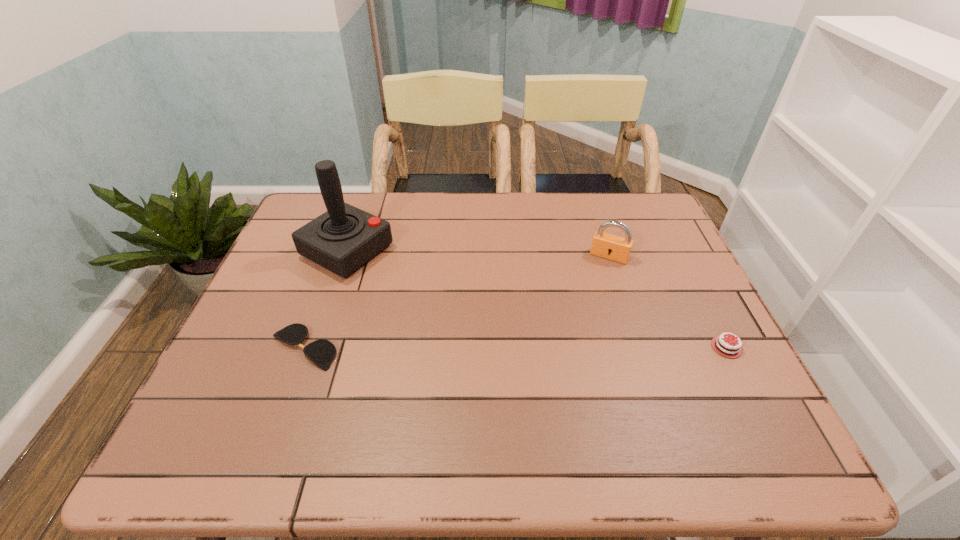
The width and height of the screenshot is (960, 540). Identify the location of vacant space situated 0.170m on the base of the joystick. (429, 292).

What are the coordinates of `vacant space situated 0.300m to unlock the third shortest object from the front` in the screenshot? It's located at (570, 340).

Image resolution: width=960 pixels, height=540 pixels. I want to click on free point located 0.180m to unlock the third shortest object from the front, so click(x=585, y=307).

Where is `free point located 0.160m to unlock the third shortest object from the front`? free point located 0.160m to unlock the third shortest object from the front is located at coordinates (587, 301).

You are a GUI agent. You are given a task and a screenshot of the screen. Output one action in this format:
    pyautogui.click(x=<x>, y=<y>)
    Task: Click on the object positioned at the far edge
    
    Given the screenshot: What is the action you would take?
    pyautogui.click(x=343, y=239)

The width and height of the screenshot is (960, 540). I want to click on spectacles at the left edge, so click(321, 352).

Identify the location of joystick situated at the left edge. Image resolution: width=960 pixels, height=540 pixels. (343, 239).

You are a GUI agent. You are given a task and a screenshot of the screen. Output one action in this format:
    pyautogui.click(x=<x>, y=<y>)
    Task: Click on the chocolate cake present at the right edge
    The height and width of the screenshot is (540, 960).
    Given the screenshot: What is the action you would take?
    722,344

Image resolution: width=960 pixels, height=540 pixels. I want to click on padlock located at the right edge, so click(608, 246).

I want to click on object at the far left corner, so 343,239.